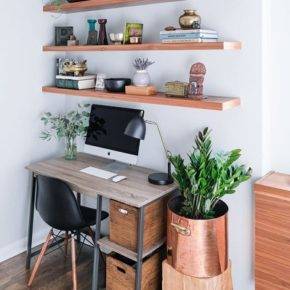
Identify the location of desk. (133, 190).